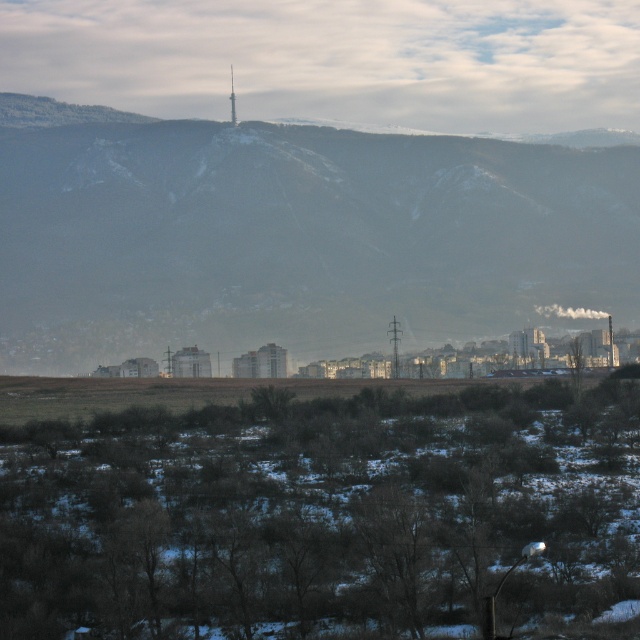
Based on the photo, you are standing at the point labeled point (612, 172) and want to walk to the point labeled point (236, 118). Which direction should you move to get closer to your destination?

To move from point (612, 172) to point (236, 118), you should move downward because point (612, 172) is closer to the viewer than point (236, 118), meaning it is higher up in the image. Moving downward will take you toward the lower part of the image where your destination is located.

You are a photographer planning to capture a wide landscape shot of the snowy mountain range at upper center and the metallic silver tower at center. Based on their sizes in the image, which object would require you to adjust your camera settings to ensure both are in focus simultaneously?

The snowy mountain range at upper center might be wider than the metallic silver tower at center, so you may need to adjust your camera settings to ensure both are in focus, possibly using a smaller aperture for greater depth of field.

You are an architect planning to build a new communication tower in the area. The existing metallic silver tower at center is already operational. Considering the snowy mountain range at upper center, which structure is taller and might interfere with signal transmission?

The snowy mountain range at upper center is taller than the metallic silver tower at center, so it might interfere more with signal transmission.